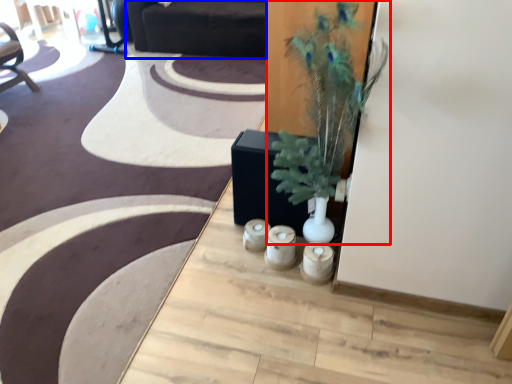
Question: Which object is further to the camera taking this photo, houseplant (highlighted by a red box) or couch (highlighted by a blue box)?

Choices:
 (A) houseplant
 (B) couch

Answer: (B)